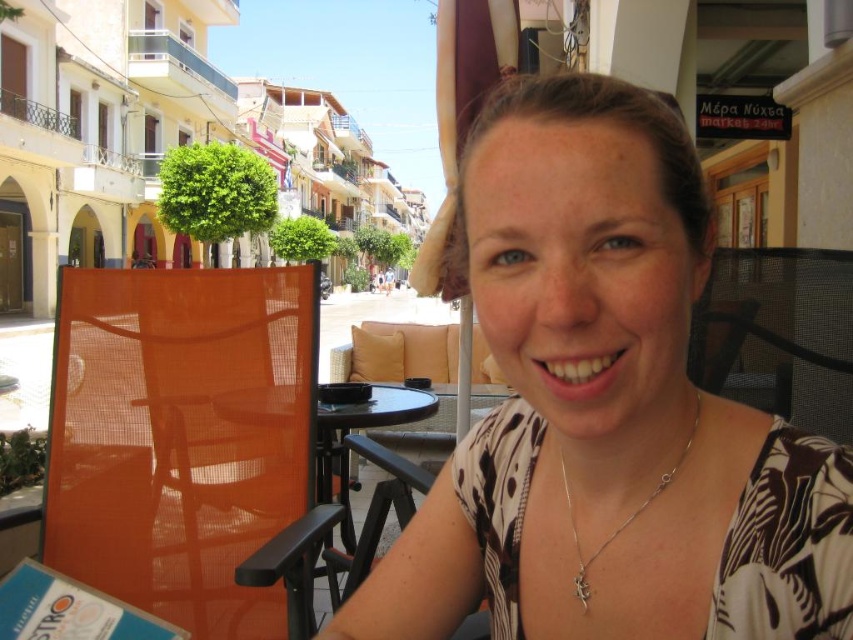
You are standing at the position of point (460,332) and want to walk to the woman sitting at the table. Which direction should you go to reach her location, considering point (425,620) is in front of you?

Since point (425,620) is in front of point (460,332), you should walk forward towards the direction of point (425,620) to reach the woman sitting at the table.

You are a customer at this outdoor cafe and want to sit comfortably. The orange mesh chair at left and the black glass table at center are in your view. Which object should you choose to sit on?

The orange mesh chair at left is smaller than the black glass table at center, so you should choose the orange mesh chair at left to sit on since chairs are meant for sitting, not tables.

You are a photographer standing at the camera position. You want to place a 2 meter long banner between the orange mesh chair at left and the camera. Is there enough space to do this without bending the banner?

The distance between the orange mesh chair at left and the camera is 1.95 meters. Since the banner is 2 meters long, it would not fit as the space is slightly shorter than the banner.